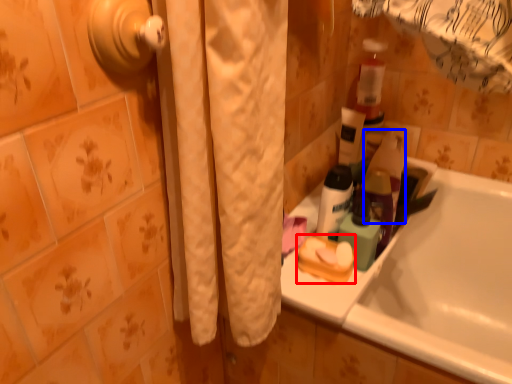
Question: Which of the following is the closest to the observer, product (highlighted by a red box) or cleaning product (highlighted by a blue box)?

Choices:
 (A) product
 (B) cleaning product

Answer: (A)